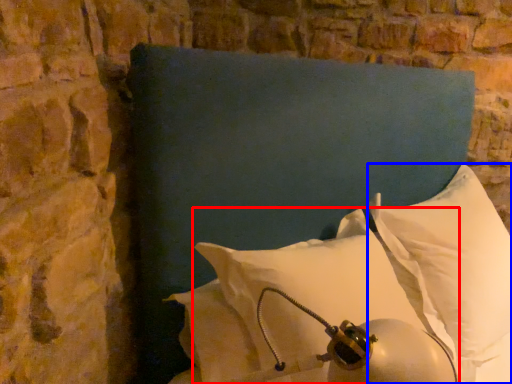
Question: Which of the following is the farthest to the observer, pillow (highlighted by a red box) or pillow (highlighted by a blue box)?

Choices:
 (A) pillow
 (B) pillow

Answer: (B)